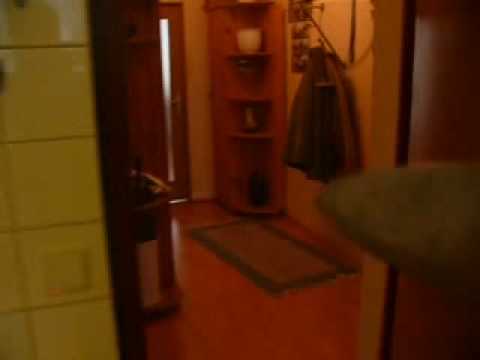
The width and height of the screenshot is (480, 360). I want to click on tile, so click(x=72, y=193).